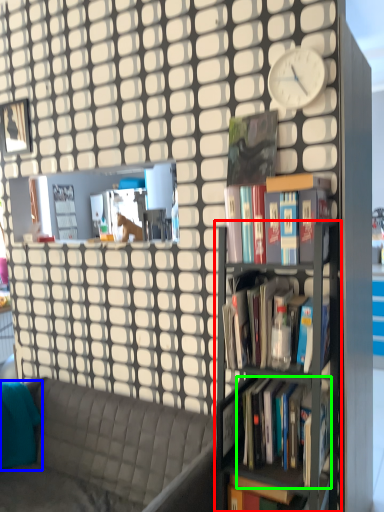
Question: Estimate the real-world distances between objects in this image. Which object is farther from bookshelf (highlighted by a red box), pillow (highlighted by a blue box) or book (highlighted by a green box)?

Choices:
 (A) pillow
 (B) book

Answer: (A)